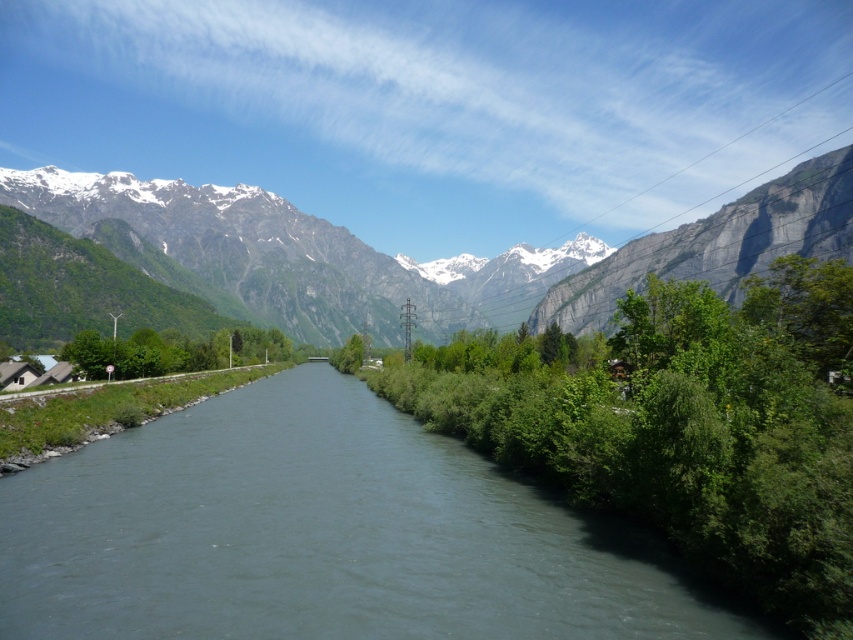
This screenshot has height=640, width=853. Identify the location of snowy granite mountains at upper center. (434, 260).

Which is above, snowy granite mountains at upper center or gray rock cliff at upper right?

snowy granite mountains at upper center

You are a GUI agent. You are given a task and a screenshot of the screen. Output one action in this format:
    pyautogui.click(x=<x>, y=<y>)
    Task: Click on the snowy granite mountains at upper center
    Image resolution: width=853 pixels, height=640 pixels.
    Given the screenshot: What is the action you would take?
    pyautogui.click(x=434, y=260)

Looking at this image, who is shorter, green grassy river at center or gray rock cliff at upper right?

Standing shorter between the two is green grassy river at center.

Does green grassy river at center appear over gray rock cliff at upper right?

No.

Is point (529, 490) closer to camera compared to point (849, 182)?

Yes, it is.

At what (x,y) coordinates should I click in order to perform the action: click on green grassy river at center. Please return your answer as a coordinate pair (x, y). The height and width of the screenshot is (640, 853). Looking at the image, I should click on (318, 534).

Does green grassy river at center lie in front of snowy granite mountains at upper center?

That is True.

Between green grassy river at center and snowy granite mountains at upper center, which one appears on the right side from the viewer's perspective?

Positioned to the right is green grassy river at center.

Which is in front, point (352, 422) or point (234, 248)?

Point (352, 422) is in front.

What are the coordinates of `green grassy river at center` in the screenshot? It's located at (318, 534).